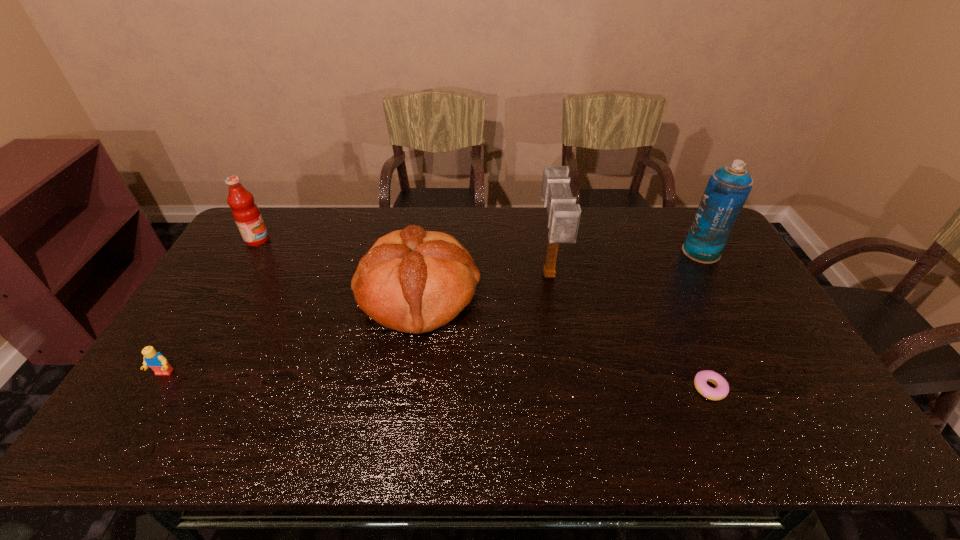
Locate an element on the screen. This screenshot has width=960, height=540. free space that satisfies the following two spatial constraints: 1. on the front label of the fourth shortest object; 2. on the right side of the fourth object from left to right is located at coordinates (236, 276).

This screenshot has height=540, width=960. What are the coordinates of `vacant area that satisfies the following two spatial constraints: 1. on the back side of the doughnut; 2. on the right side of the rightmost object` in the screenshot? It's located at (650, 252).

Identify the location of vacant region that satisfies the following two spatial constraints: 1. on the front label of the fruit juice; 2. on the left side of the mallet. The width and height of the screenshot is (960, 540). (236, 276).

This screenshot has width=960, height=540. Identify the location of vacant point that satisfies the following two spatial constraints: 1. on the front label of the third tallest object; 2. on the right side of the fourth object from left to right. (236, 276).

Locate an element on the screen. The width and height of the screenshot is (960, 540). vacant space that satisfies the following two spatial constraints: 1. on the front label of the fruit juice; 2. on the left side of the third object from left to right is located at coordinates (226, 293).

Where is `vacant position in the image that satisfies the following two spatial constraints: 1. on the front label of the fourth shortest object; 2. on the right side of the mallet`? The height and width of the screenshot is (540, 960). vacant position in the image that satisfies the following two spatial constraints: 1. on the front label of the fourth shortest object; 2. on the right side of the mallet is located at coordinates (236, 276).